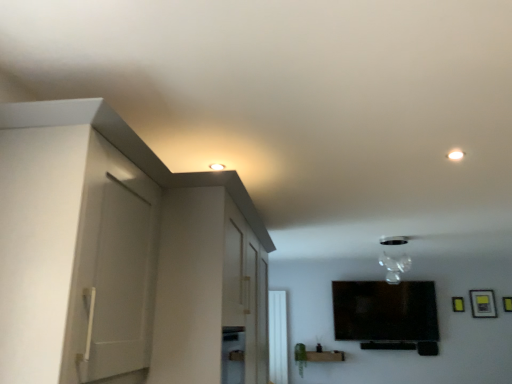
Question: In terms of width, does transparent glass vase at upper center look wider or thinner when compared to yellow matte picture frame at upper right, which is the second picture frame from right to left?

Choices:
 (A) thin
 (B) wide

Answer: (B)

Question: Is transparent glass vase at upper center spatially inside yellow matte picture frame at upper right, which appears as the first picture frame when viewed from the left, or outside of it?

Choices:
 (A) outside
 (B) inside

Answer: (A)

Question: Which object is positioned closest to the yellow matte picture frame at upper right, which appears as the first picture frame when viewed from the left?

Choices:
 (A) matte black picture frame at upper right, the first picture frame positioned from the right
 (B) matte black vase at lower center
 (C) transparent glass vase at upper center
 (D) white matte cabinet at left
 (E) white glossy window at center

Answer: (A)

Question: Considering the real-world distances, which object is farthest from the white matte cabinet at left?

Choices:
 (A) matte black vase at lower center
 (B) transparent glass vase at upper center
 (C) matte black picture frame at upper right, the first picture frame positioned from the right
 (D) yellow matte picture frame at upper right, which is the second picture frame from right to left
 (E) white glossy window at center

Answer: (D)